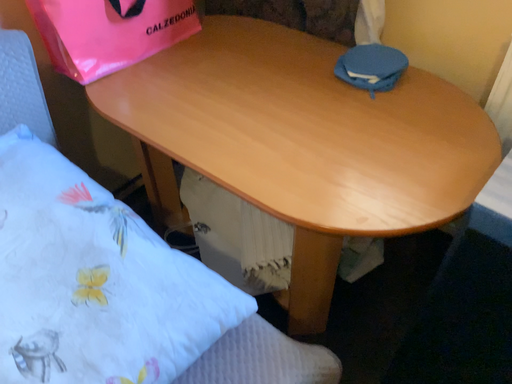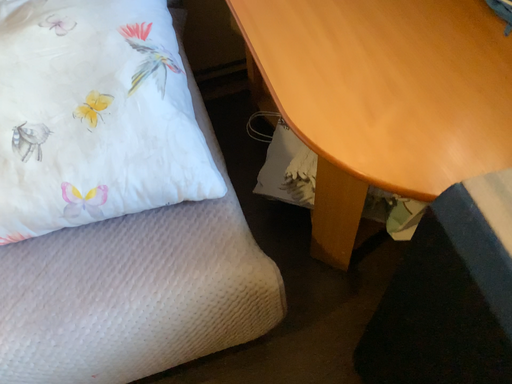
Question: Which way did the camera rotate in the video?

Choices:
 (A) rotated upward
 (B) rotated downward

Answer: (B)